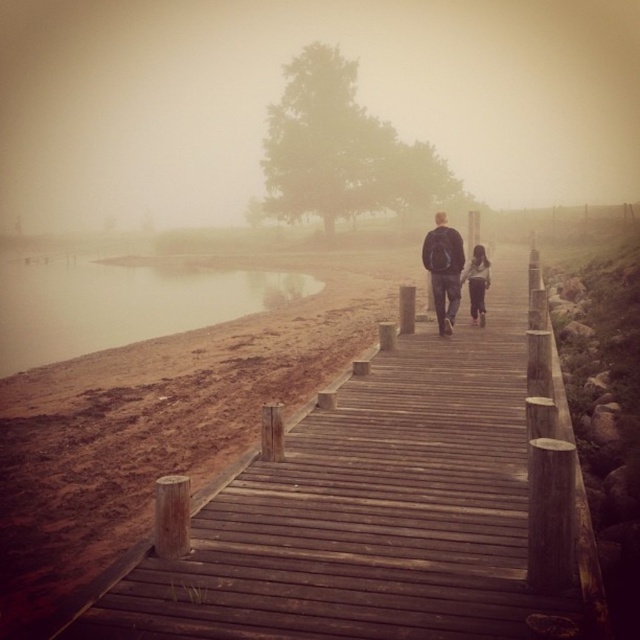
Question: Which object is closer to the camera taking this photo?

Choices:
 (A) dark brown leather jacket at center
 (B) wooden dock at center
 (C) brown dirt at lower left

Answer: (B)

Question: Is wooden dock at center wider than light gray sweater at center?

Choices:
 (A) yes
 (B) no

Answer: (A)

Question: Which point appears farthest from the camera in this image?

Choices:
 (A) (433, 252)
 (B) (474, 292)

Answer: (B)

Question: Does brown dirt at lower left have a larger size compared to light gray sweater at center?

Choices:
 (A) yes
 (B) no

Answer: (A)

Question: Estimate the real-world distances between objects in this image. Which object is closer to the light gray sweater at center?

Choices:
 (A) dark brown leather jacket at center
 (B) brown dirt at lower left

Answer: (A)

Question: Considering the relative positions of wooden dock at center and brown dirt at lower left in the image provided, where is wooden dock at center located with respect to brown dirt at lower left?

Choices:
 (A) left
 (B) right

Answer: (B)